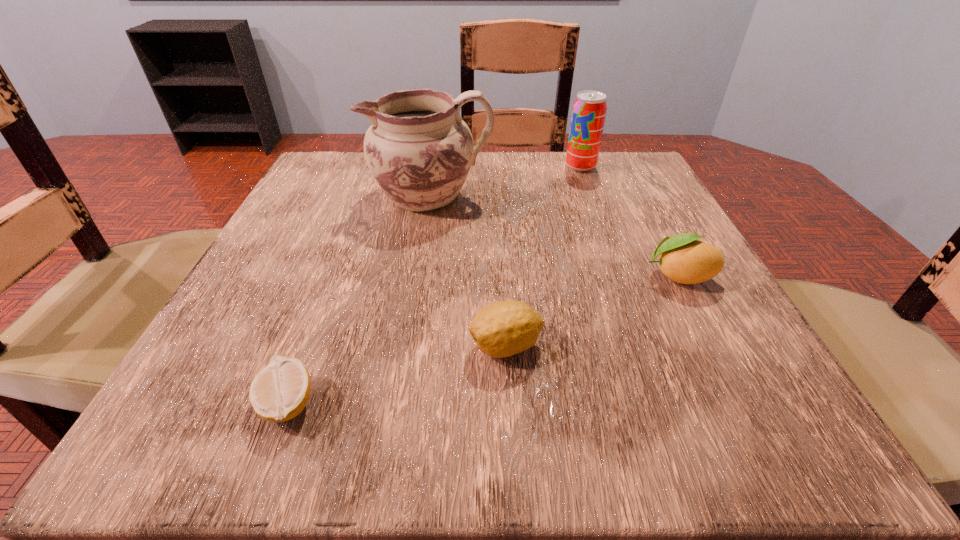
This screenshot has width=960, height=540. In order to click on free point between the farthest lemon and the second tallest object in this screenshot , I will do `click(630, 221)`.

The image size is (960, 540). I want to click on vacant space that is in between the soda can and the pitcher, so click(506, 181).

Where is `unoccupied position between the second lemon from left to right and the nearest object`? The width and height of the screenshot is (960, 540). unoccupied position between the second lemon from left to right and the nearest object is located at coordinates (396, 375).

At what (x,y) coordinates should I click in order to perform the action: click on free space that is in between the pitcher and the shortest lemon. Please return your answer as a coordinate pair (x, y). This screenshot has width=960, height=540. Looking at the image, I should click on (359, 300).

You are a GUI agent. You are given a task and a screenshot of the screen. Output one action in this format:
    pyautogui.click(x=<x>, y=<y>)
    Task: Click on the vacant space in between the second farthest lemon and the leftmost lemon
    
    Given the screenshot: What is the action you would take?
    pyautogui.click(x=396, y=375)

Identify which object is located as the second nearest to the second lemon from right to left. Please provide its 2D coordinates. Your answer should be formatted as a tuple, i.e. [(x, y)], where the tuple contains the x and y coordinates of a point satisfying the conditions above.

[(684, 259)]

Where is `object that is the fourth nearest to the rightmost object`? The width and height of the screenshot is (960, 540). object that is the fourth nearest to the rightmost object is located at coordinates (279, 392).

Identify which lemon is the second closest to the fourth farthest object. Please provide its 2D coordinates. Your answer should be formatted as a tuple, i.e. [(x, y)], where the tuple contains the x and y coordinates of a point satisfying the conditions above.

[(684, 259)]

Identify which lemon is the second nearest to the pitcher. Please provide its 2D coordinates. Your answer should be formatted as a tuple, i.e. [(x, y)], where the tuple contains the x and y coordinates of a point satisfying the conditions above.

[(684, 259)]